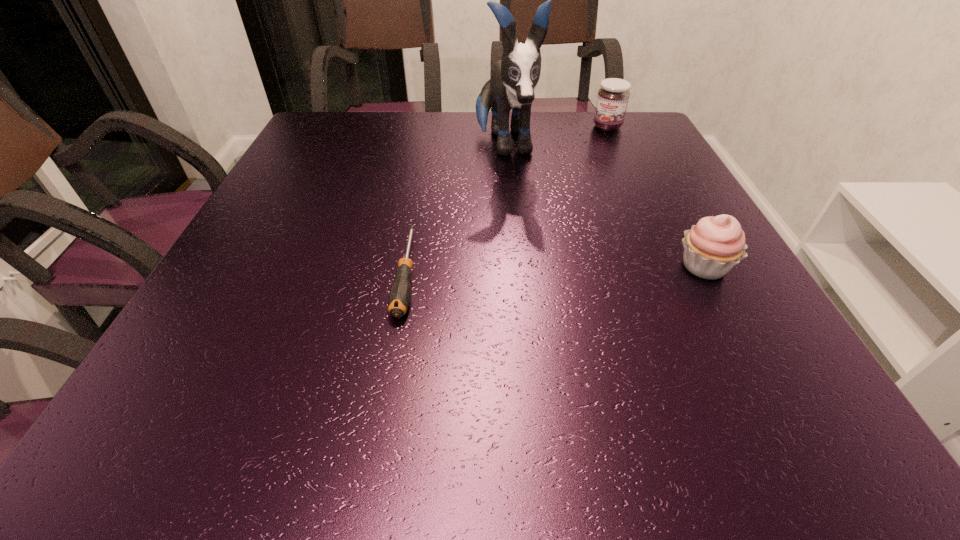
Where is `free spot between the jam and the leftmost object`? The image size is (960, 540). free spot between the jam and the leftmost object is located at coordinates (507, 200).

Locate an element on the screen. vacant area that lies between the third object from right to left and the jam is located at coordinates (556, 136).

Locate an element on the screen. The height and width of the screenshot is (540, 960). free space between the jam and the cupcake is located at coordinates (656, 197).

Identify the location of vacant area that lies between the third object from right to left and the cupcake. The width and height of the screenshot is (960, 540). (604, 206).

Locate an element on the screen. unoccupied position between the shortest object and the tallest object is located at coordinates (455, 209).

Where is `object that is the second closest to the jam`? This screenshot has width=960, height=540. object that is the second closest to the jam is located at coordinates (714, 245).

At what (x,y) coordinates should I click in order to perform the action: click on object that stands as the third closest to the third object from right to left. Please return your answer as a coordinate pair (x, y). Looking at the image, I should click on (714, 245).

At what (x,y) coordinates should I click in order to perform the action: click on blank space that satisfies the following two spatial constraints: 1. on the front side of the cupcake; 2. on the left side of the jam. Please return your answer as a coordinate pair (x, y). Looking at the image, I should click on (672, 267).